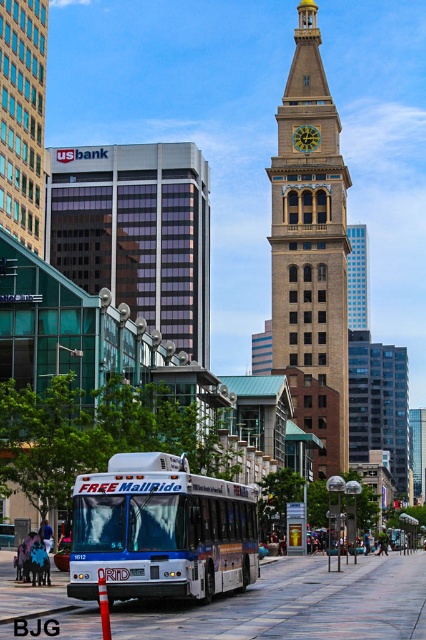
You are a city planner analyzing the layout of the urban area. Given the brown stone clock tower at center and the blue matte bus at center, which object occupies more horizontal space in the image?

The brown stone clock tower at center has a larger width than the blue matte bus at center, so it occupies more horizontal space in the image.

You are standing at point (158,595) and want to walk to the historic clock tower in the background. Is the point (321,308) between you and the clock tower?

Yes, the point (321,308) is between you and the clock tower because it is behind point (158,595), which is your current position.